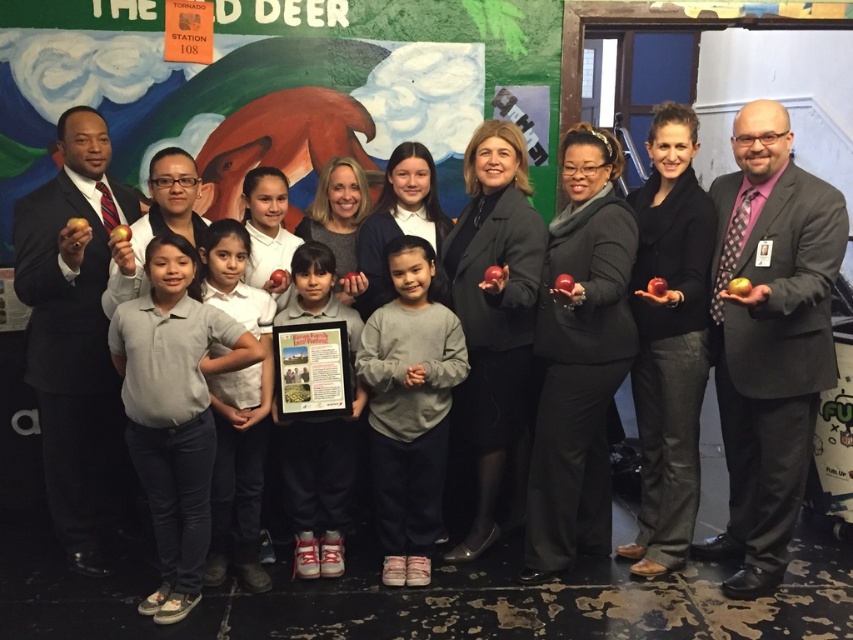
You are a photographer trying to capture a group photo. You notice two people in the front row wearing a matte black suit at center and a gray cotton shirt at center. Which person has a wider clothing item?

The gray cotton shirt at center is wider than the matte black suit at center, so the person wearing the gray cotton shirt at center has a wider clothing item.

You are standing in the room where the group is gathered. You need to find the matte black suit at center quickly. Based on the coordinates provided, where should you look relative to the image?

The matte black suit at center is located at point 0.528 on the horizontal axis and 0.903 on the vertical axis, meaning it is positioned slightly to the right and near the bottom of the image.